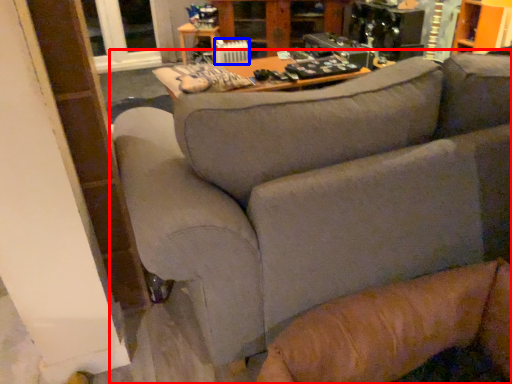
Question: Which object is further to the camera taking this photo, studio couch (highlighted by a red box) or radiator (highlighted by a blue box)?

Choices:
 (A) studio couch
 (B) radiator

Answer: (B)